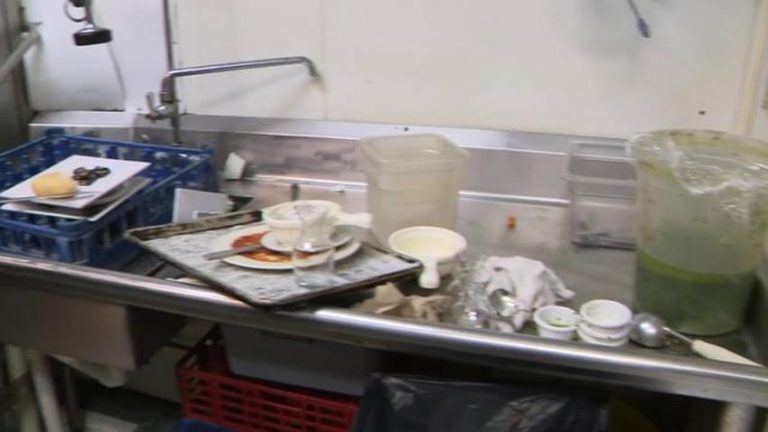
The image size is (768, 432). Find the location of `tray`. tray is located at coordinates (166, 243).